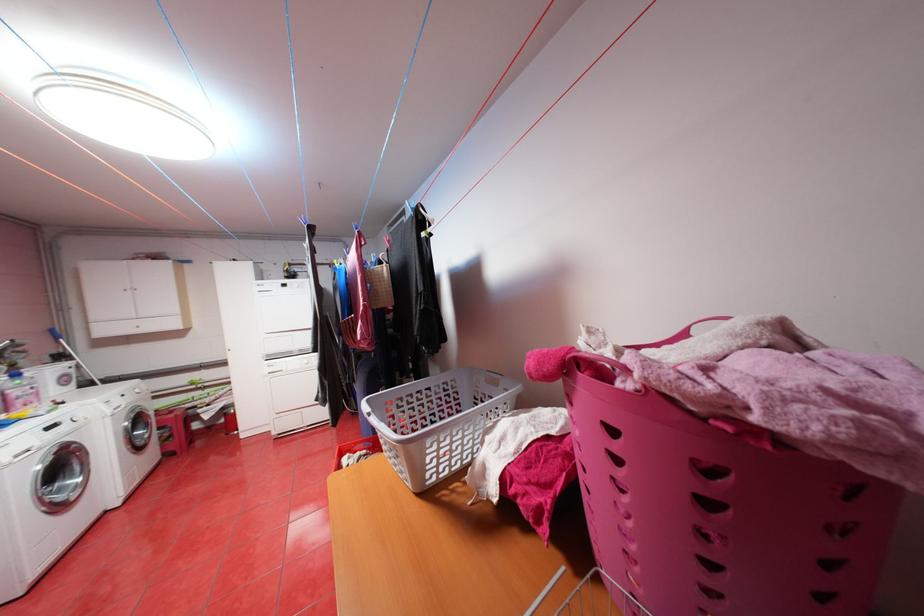
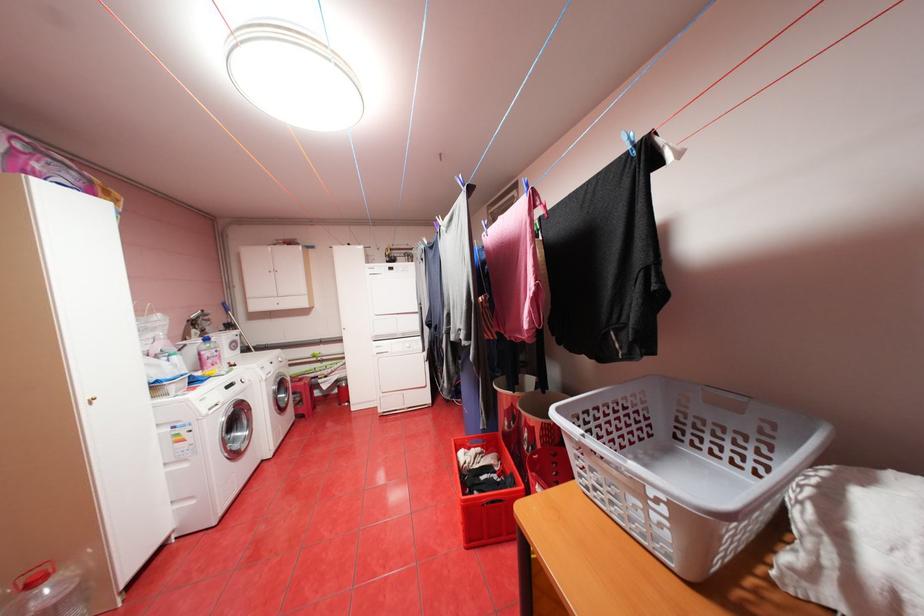
Find the pixel in the second image that matches the point at 140,439 in the first image.

(286, 400)